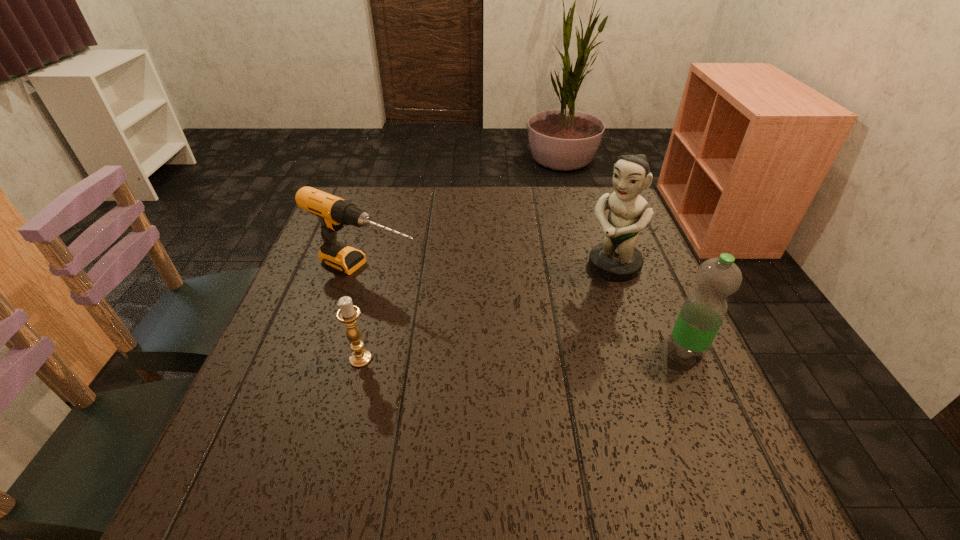
The width and height of the screenshot is (960, 540). Identify the location of free space at the near left corner of the desktop. (270, 410).

At what (x,y) coordinates should I click in order to perform the action: click on vacant point located between the third shortest object and the candle holder. Please return your answer as a coordinate pair (x, y). The height and width of the screenshot is (540, 960). Looking at the image, I should click on (523, 353).

The width and height of the screenshot is (960, 540). What are the coordinates of `free area in between the tallest object and the drill` in the screenshot? It's located at (489, 268).

You are a GUI agent. You are given a task and a screenshot of the screen. Output one action in this format:
    pyautogui.click(x=<x>, y=<y>)
    Task: Click on the free space between the drill and the shortest object
    
    Given the screenshot: What is the action you would take?
    pyautogui.click(x=363, y=315)

Locate an element on the screen. The height and width of the screenshot is (540, 960). vacant area that lies between the drill and the water bottle is located at coordinates (526, 309).

Locate an element on the screen. free space that is in between the tallest object and the shortest object is located at coordinates (487, 312).

Identify the location of vacant region between the drill and the figurine. (489, 268).

You are a GUI agent. You are given a task and a screenshot of the screen. Output one action in this format:
    pyautogui.click(x=<x>, y=<y>)
    Task: Click on the empty space between the figurine and the second shortest object
    The image size is (960, 540).
    Given the screenshot: What is the action you would take?
    pyautogui.click(x=489, y=268)

Where is `vacant space that's between the drill and the third shortest object`? vacant space that's between the drill and the third shortest object is located at coordinates (526, 309).

The image size is (960, 540). I want to click on free space that is in between the candle holder and the water bottle, so click(x=523, y=353).